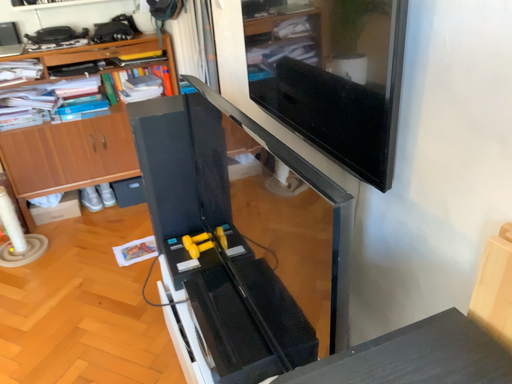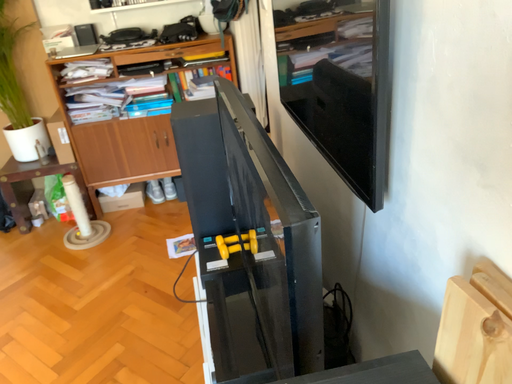
Question: How did the camera likely rotate when shooting the video?

Choices:
 (A) rotated right
 (B) rotated left

Answer: (B)